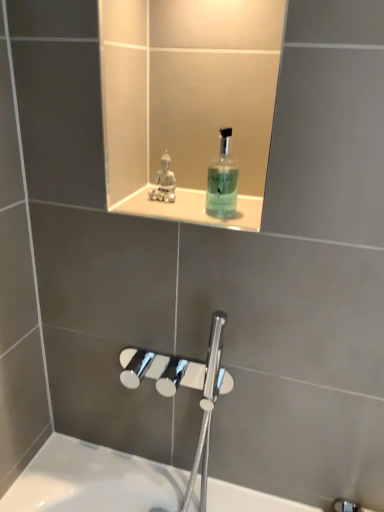
Question: In terms of height, does white glossy ledge at upper center look taller or shorter compared to translucent glass mouthwash at upper center?

Choices:
 (A) short
 (B) tall

Answer: (A)

Question: Is white glossy ledge at upper center inside or outside of translucent glass mouthwash at upper center?

Choices:
 (A) inside
 (B) outside

Answer: (B)

Question: Which object is positioned closest to the satin silver statue at upper center?

Choices:
 (A) white glossy ledge at upper center
 (B) translucent glass mouthwash at upper center

Answer: (A)

Question: Which is farther from the white glossy ledge at upper center?

Choices:
 (A) translucent glass mouthwash at upper center
 (B) satin silver statue at upper center

Answer: (B)